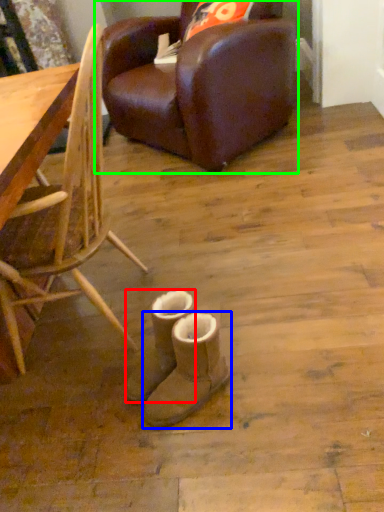
Question: Which is nearer to the footwear (highlighted by a red box)? footwear (highlighted by a blue box) or chair (highlighted by a green box).

Choices:
 (A) footwear
 (B) chair

Answer: (A)